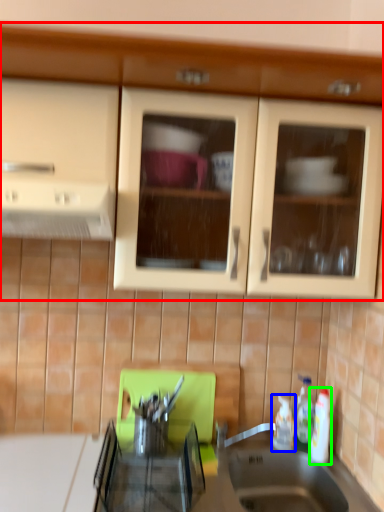
Question: Which is nearer to the cabinetry (highlighted by a red box)? bottle (highlighted by a blue box) or bottle (highlighted by a green box).

Choices:
 (A) bottle
 (B) bottle

Answer: (B)